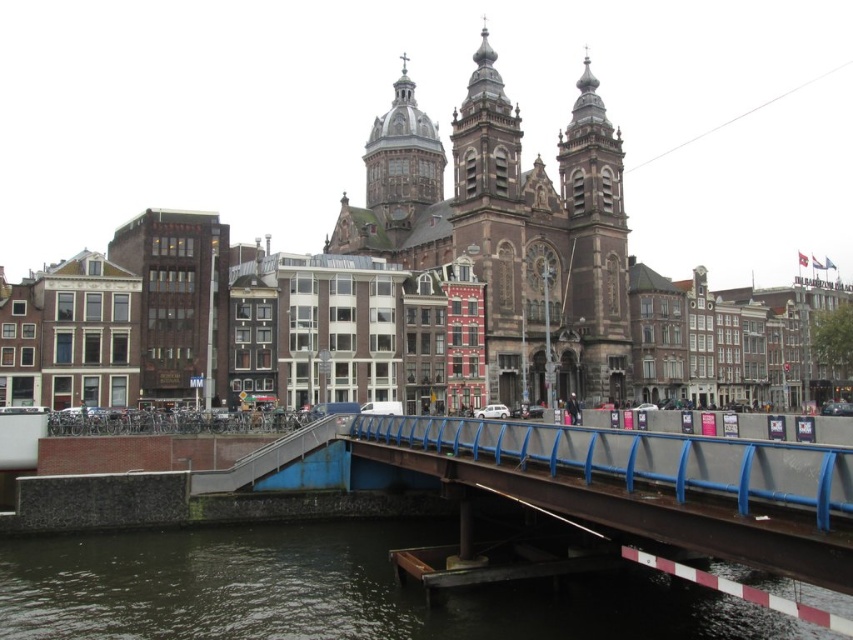
In the scene shown: Measure the distance between dark gray water at lower center and blue metallic railing at center.

A distance of 12.76 meters exists between dark gray water at lower center and blue metallic railing at center.

Is point (828, 636) positioned behind point (425, 444)?

No, it is not.

Where is `dark gray water at lower center`? dark gray water at lower center is located at coordinates (332, 592).

Does dark gray water at lower center appear on the right side of brown stone church at center?

In fact, dark gray water at lower center is to the left of brown stone church at center.

Can you confirm if dark gray water at lower center is wider than brown stone church at center?

Yes, dark gray water at lower center is wider than brown stone church at center.

Is point (410, 598) positioned before point (625, 296)?

Yes, point (410, 598) is in front of point (625, 296).

Image resolution: width=853 pixels, height=640 pixels. Find the location of `dark gray water at lower center`. dark gray water at lower center is located at coordinates (332, 592).

Between brown stone church at center and blue metallic railing at center, which one appears on the right side from the viewer's perspective?

From the viewer's perspective, blue metallic railing at center appears more on the right side.

Which is behind, point (614, 216) or point (611, 445)?

The point (614, 216) is more distant.

Where is `brown stone church at center`? The image size is (853, 640). brown stone church at center is located at coordinates (509, 228).